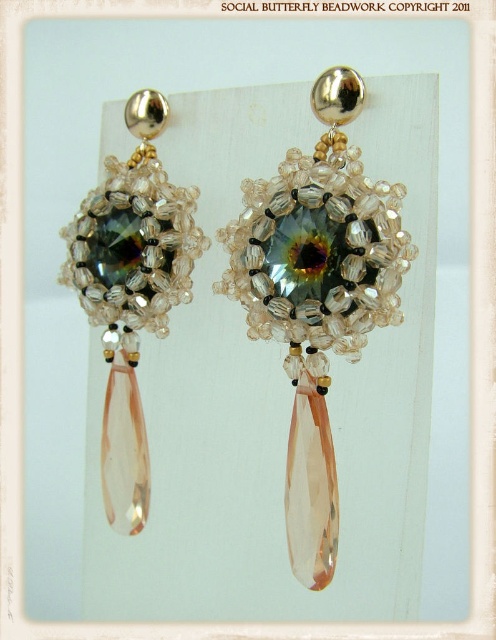
You are an appraiser examining the earrings. You notice two points marked on the image at coordinates point [337,531] and point [103,209]. Which point is positioned closer to your perspective as you view the earrings?

Point [337,531] is closer to the viewer than point [103,209].

You are a jewelry designer examining the earrings. You need to determine which object is bigger between the matte glass earring at center and the matte silver beadwork at left. Which one is larger?

The matte glass earring at center is larger than the matte silver beadwork at left.

You are a jeweler examining the earrings. You need to determine which part of the earring is taller between the matte glass earring at center and the matte silver beadwork at left. Which one is taller?

The matte glass earring at center is much taller than the matte silver beadwork at left.